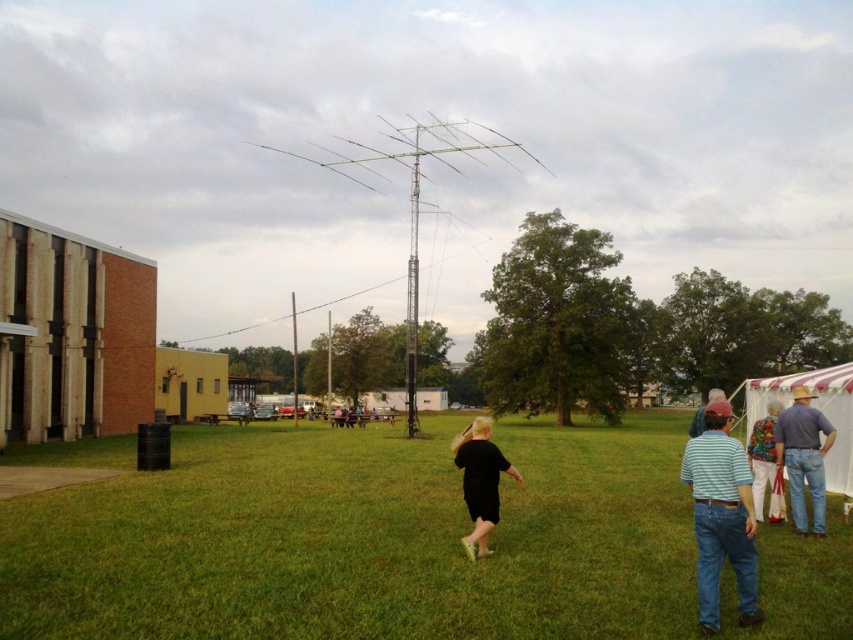
Between point (718, 609) and point (805, 467), which one is positioned behind?

The point (805, 467) is behind.

Find the location of a particular element. striped cotton shirt at right is located at coordinates (721, 516).

The height and width of the screenshot is (640, 853). What are the coordinates of `striped cotton shirt at right` in the screenshot? It's located at (721, 516).

Is striped cotton shirt at right bigger than black matte shirt at center?

No, striped cotton shirt at right is not bigger than black matte shirt at center.

Does striped cotton shirt at right have a greater height compared to black matte shirt at center?

Incorrect, striped cotton shirt at right's height is not larger of black matte shirt at center's.

Where is `striped cotton shirt at right`? This screenshot has height=640, width=853. striped cotton shirt at right is located at coordinates (721, 516).

Which is behind, point (416, 513) or point (730, 500)?

The point (416, 513) is more distant.

Between point (608, 518) and point (722, 436), which one is positioned in front?

Positioned in front is point (722, 436).

This screenshot has width=853, height=640. Identify the location of green grass at center. (361, 538).

Identify the location of green grass at center. (361, 538).